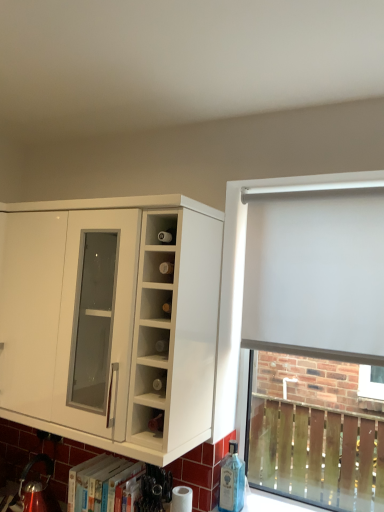
Question: Does white glossy cabinet at left appear on the right side of white fabric curtain at right?

Choices:
 (A) no
 (B) yes

Answer: (A)

Question: Is white glossy cabinet at left next to white fabric curtain at right?

Choices:
 (A) no
 (B) yes

Answer: (A)

Question: Considering the relative sizes of white glossy cabinet at left and white fabric curtain at right in the image provided, is white glossy cabinet at left wider than white fabric curtain at right?

Choices:
 (A) no
 (B) yes

Answer: (B)

Question: Is white glossy cabinet at left bigger than white fabric curtain at right?

Choices:
 (A) no
 (B) yes

Answer: (B)

Question: From the image's perspective, does white glossy cabinet at left appear lower than white fabric curtain at right?

Choices:
 (A) no
 (B) yes

Answer: (B)

Question: From the image's perspective, is white fabric curtain at right above or below white matte roller blind at right?

Choices:
 (A) above
 (B) below

Answer: (A)

Question: Which is correct: white fabric curtain at right is inside white matte roller blind at right, or outside of it?

Choices:
 (A) inside
 (B) outside

Answer: (B)

Question: From a real-world perspective, relative to white matte roller blind at right, is white fabric curtain at right vertically above or below?

Choices:
 (A) above
 (B) below

Answer: (A)

Question: Visually, is white fabric curtain at right positioned to the left or to the right of white matte roller blind at right?

Choices:
 (A) right
 (B) left

Answer: (B)

Question: Is white glossy cabinet at left situated inside white fabric curtain at right or outside?

Choices:
 (A) inside
 (B) outside

Answer: (B)

Question: Considering the positions of point (61, 372) and point (269, 282), is point (61, 372) closer or farther from the camera than point (269, 282)?

Choices:
 (A) closer
 (B) farther

Answer: (A)

Question: Is white glossy cabinet at left to the left or to the right of white fabric curtain at right in the image?

Choices:
 (A) right
 (B) left

Answer: (B)

Question: From the image's perspective, relative to white fabric curtain at right, is white glossy cabinet at left above or below?

Choices:
 (A) below
 (B) above

Answer: (A)

Question: Considering the positions of white glossy cabinet at left and white matte roller blind at right in the image, is white glossy cabinet at left taller or shorter than white matte roller blind at right?

Choices:
 (A) tall
 (B) short

Answer: (B)

Question: Does point (81, 408) appear closer or farther from the camera than point (311, 371)?

Choices:
 (A) closer
 (B) farther

Answer: (A)